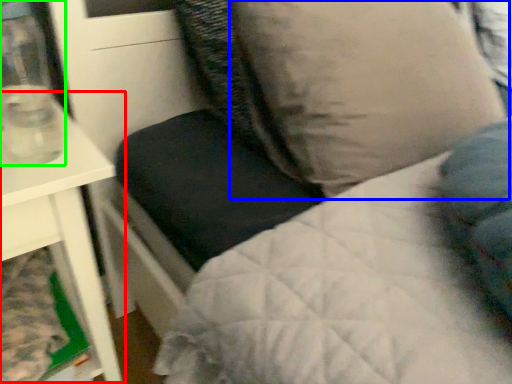
Question: Estimate the real-world distances between objects in this image. Which object is farther from table (highlighted by a red box), pillow (highlighted by a blue box) or glass vase (highlighted by a green box)?

Choices:
 (A) pillow
 (B) glass vase

Answer: (A)